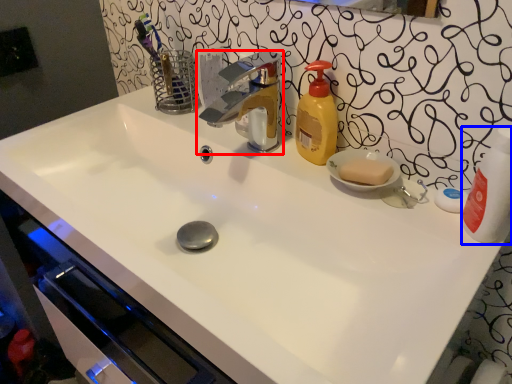
Question: Which point is further to the camera, tap (highlighted by a red box) or cleaning product (highlighted by a blue box)?

Choices:
 (A) tap
 (B) cleaning product

Answer: (A)